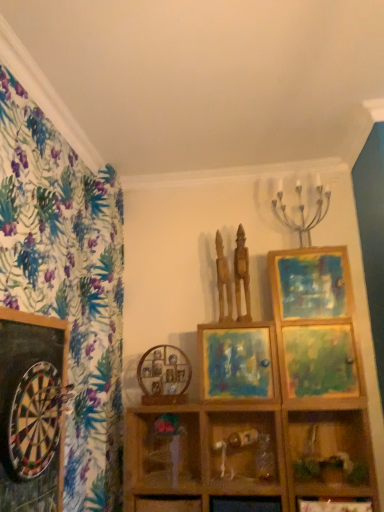
Question: Considering the relative sizes of matte wooden picture frame at center, which ranks as the 2th picture frame in back-to-front order, and wooden vase at center in the image provided, is matte wooden picture frame at center, which ranks as the 2th picture frame in back-to-front order, wider than wooden vase at center?

Choices:
 (A) no
 (B) yes

Answer: (B)

Question: Is matte wooden picture frame at center, which ranks as the first picture frame in right-to-left order, oriented away from wooden vase at center?

Choices:
 (A) yes
 (B) no

Answer: (B)

Question: From a real-world perspective, is matte wooden picture frame at center, which ranks as the first picture frame in right-to-left order, on wooden vase at center?

Choices:
 (A) no
 (B) yes

Answer: (B)

Question: From a real-world perspective, does matte wooden picture frame at center, arranged as the 2th picture frame when viewed from the front, sit lower than wooden vase at center?

Choices:
 (A) yes
 (B) no

Answer: (B)

Question: Considering the relative sizes of matte wooden picture frame at center, which ranks as the 2th picture frame in back-to-front order, and wooden vase at center in the image provided, is matte wooden picture frame at center, which ranks as the 2th picture frame in back-to-front order, taller than wooden vase at center?

Choices:
 (A) no
 (B) yes

Answer: (B)

Question: Is matte wooden picture frame at center, the 3th picture frame positioned from the left, positioned in front of wooden vase at center?

Choices:
 (A) no
 (B) yes

Answer: (A)

Question: Can you confirm if wooden statue at upper center, marked as the 2th sculpture in a left-to-right arrangement, is bigger than wooden figurine at center, which is counted as the second shelf, starting from the left?

Choices:
 (A) no
 (B) yes

Answer: (A)

Question: Does wooden statue at upper center, the 1th sculpture viewed from the right, have a lesser width compared to wooden figurine at center, which is the second shelf in right-to-left order?

Choices:
 (A) no
 (B) yes

Answer: (A)

Question: Can wooden figurine at center, which is the second shelf in right-to-left order, be found inside wooden statue at upper center, the 1th sculpture viewed from the right?

Choices:
 (A) yes
 (B) no

Answer: (B)

Question: Is wooden statue at upper center, the 1th sculpture viewed from the right, to the right of wooden figurine at center, which is the second shelf in right-to-left order, from the viewer's perspective?

Choices:
 (A) no
 (B) yes

Answer: (B)

Question: Can you confirm if wooden statue at upper center, marked as the 2th sculpture in a left-to-right arrangement, is taller than wooden figurine at center, which is the second shelf in right-to-left order?

Choices:
 (A) yes
 (B) no

Answer: (A)

Question: Is wooden statue at upper center, marked as the 2th sculpture in a left-to-right arrangement, shorter than wooden figurine at center, which is the second shelf in right-to-left order?

Choices:
 (A) yes
 (B) no

Answer: (B)

Question: Does wooden statue at upper center, positioned as the 2th sculpture in right-to-left order, have a greater width compared to wooden statue at upper center, the 1th sculpture viewed from the right?

Choices:
 (A) yes
 (B) no

Answer: (A)